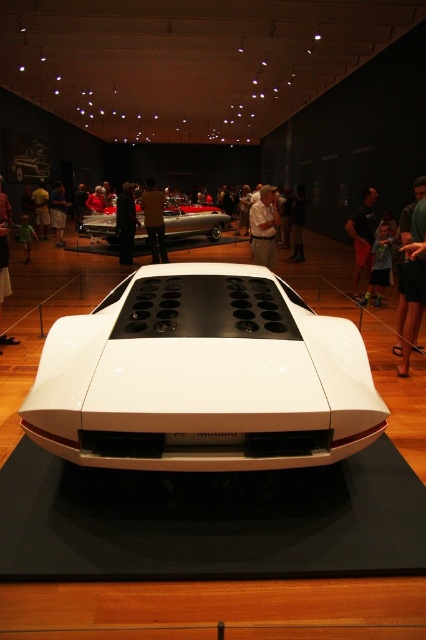
Question: Can you confirm if white matte/black textured mat at center is positioned below matte black jacket at center?

Choices:
 (A) yes
 (B) no

Answer: (A)

Question: Which point is farther to the camera?

Choices:
 (A) green fabric person at lower left
 (B) matte black suit at center
 (C) dark brown leather jacket at center
 (D) green fabric shorts at right

Answer: (C)

Question: Does brown leather jacket at center appear over white matte shirt at center?

Choices:
 (A) yes
 (B) no

Answer: (B)

Question: Among these points, which one is farthest from the camera?

Choices:
 (A) (32, 202)
 (B) (252, 376)
 (C) (383, 272)
 (D) (296, 216)

Answer: (A)

Question: Is white matte sports car at center smaller than shiny silver car at center?

Choices:
 (A) yes
 (B) no

Answer: (B)

Question: Which point appears farthest from the camera in this image?

Choices:
 (A) (89, 234)
 (B) (290, 257)
 (C) (405, 230)
 (D) (43, 364)

Answer: (A)